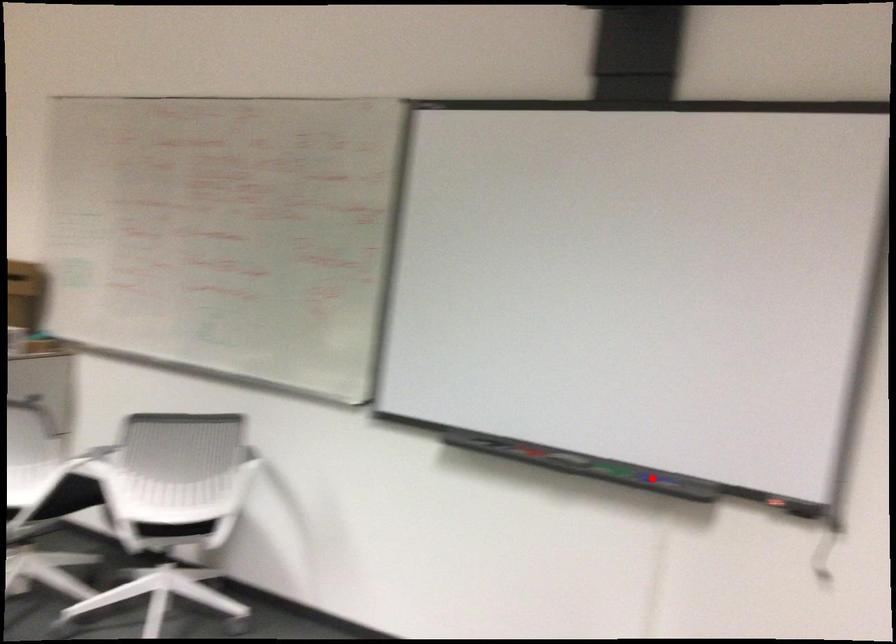
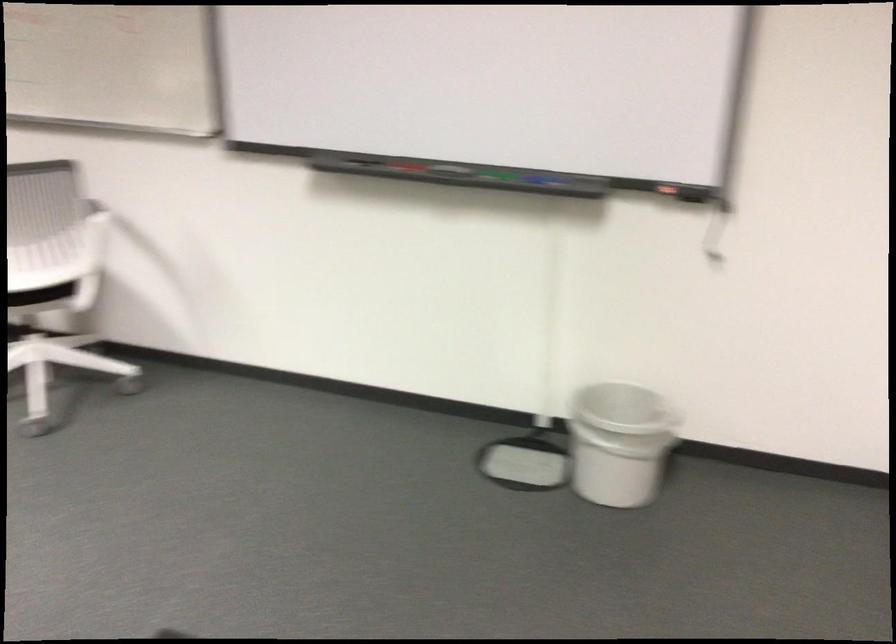
Where in the second image is the point corresponding to the highlighted location from the first image?

(536, 178)